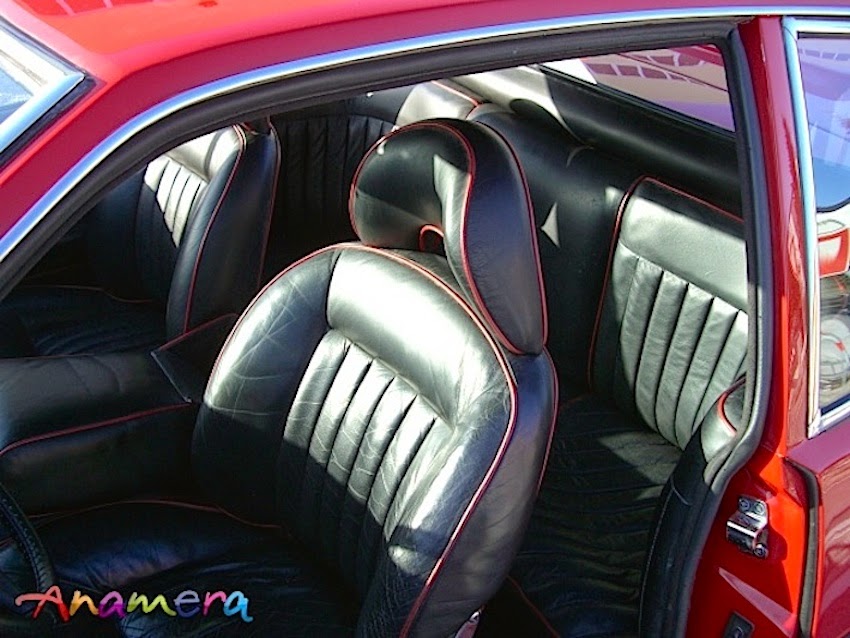
Identify the location of seat. (259, 549).